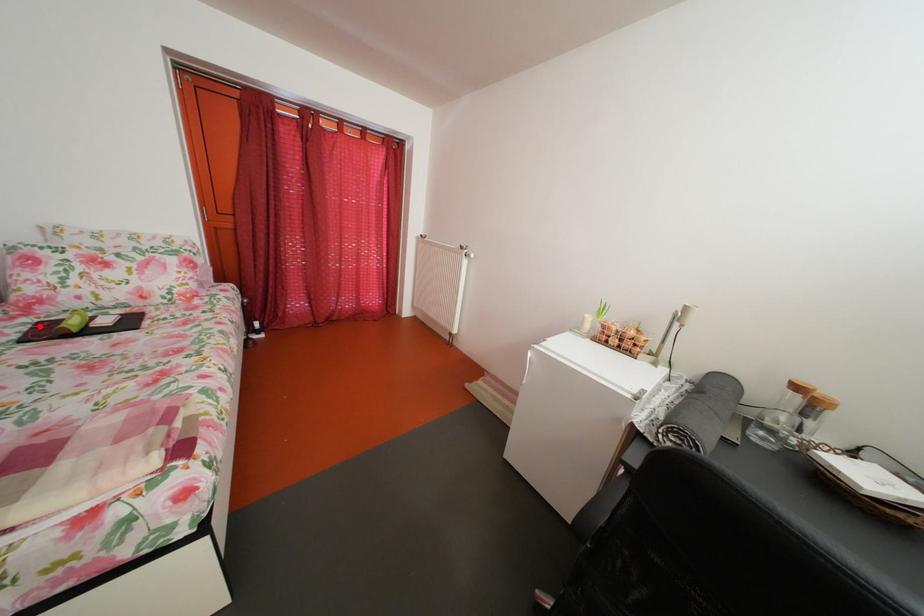
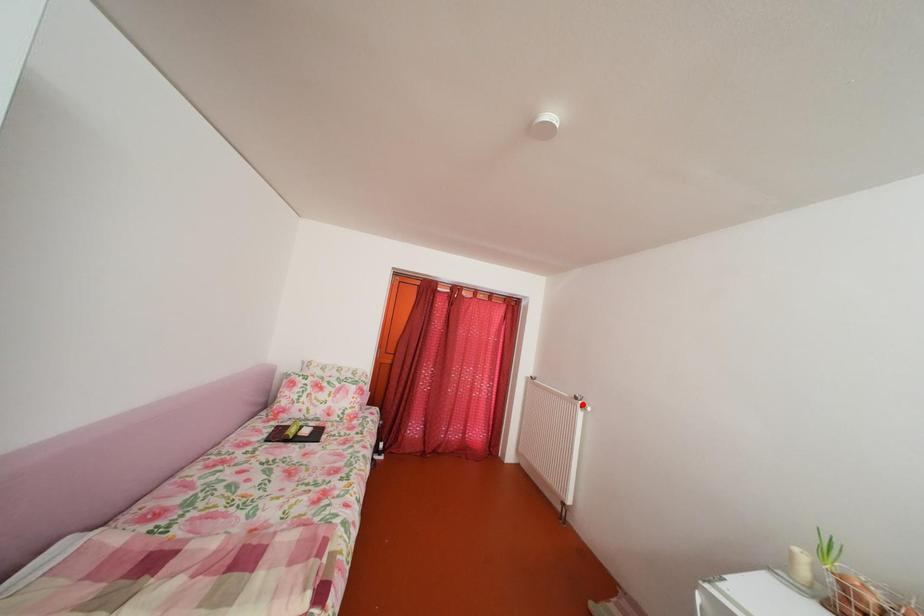
I am providing you with two images of the same scene from different viewpoints. A red point is marked on the first image and another point is marked on the second image. Is the marked point in image1 the same physical position as the marked point in image2?

No